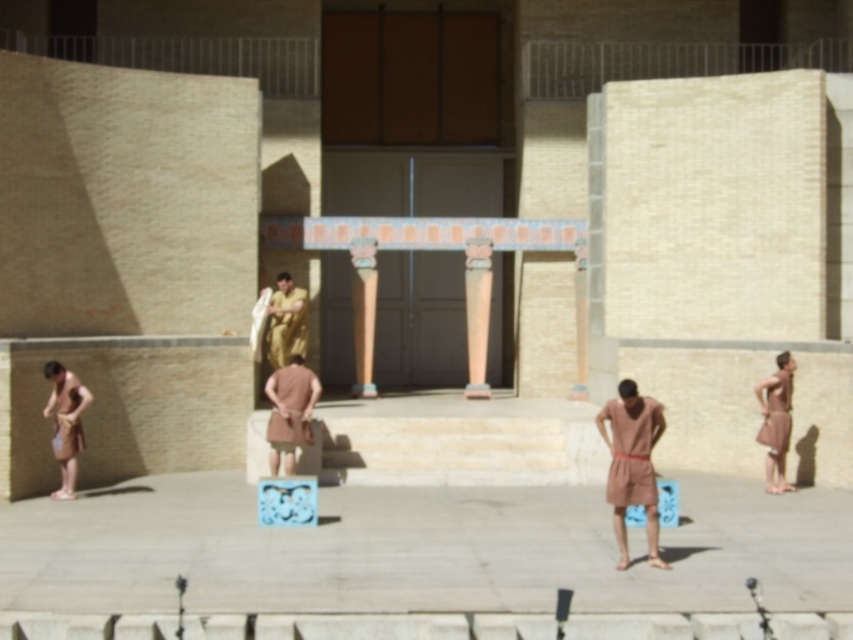
Question: Can you confirm if smooth beige column at center is positioned to the left of gold fabric man at center?

Choices:
 (A) no
 (B) yes

Answer: (A)

Question: Which point is closer to the camera?

Choices:
 (A) (50, 412)
 (B) (476, 323)
 (C) (788, 376)

Answer: (A)

Question: Which of the following is the closest to the observer?

Choices:
 (A) (770, 412)
 (B) (285, 456)
 (C) (643, 451)
 (D) (469, 257)

Answer: (C)

Question: Which point is closer to the camera taking this photo?

Choices:
 (A) (265, 340)
 (B) (602, 429)
 (C) (761, 406)
 (D) (483, 278)

Answer: (B)

Question: Is brown fabric skirt at center below brown fabric at right?

Choices:
 (A) yes
 (B) no

Answer: (B)

Question: Is brown cloth at center further to camera compared to gold fabric man at center?

Choices:
 (A) yes
 (B) no

Answer: (B)